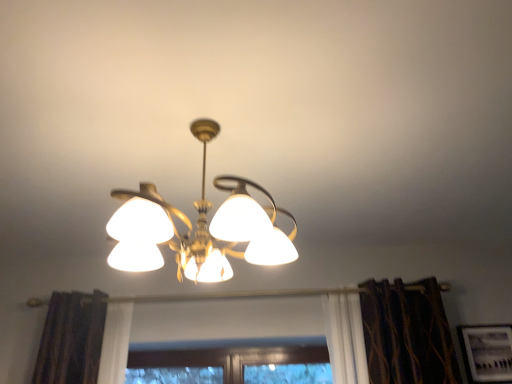
The width and height of the screenshot is (512, 384). Describe the element at coordinates (486, 353) in the screenshot. I see `matte white picture frame at lower right` at that location.

In order to face matte white picture frame at lower right, should I rotate leftwards or rightwards?

A 28.943 degree turn to the right will do.

In order to click on matte white picture frame at lower right in this screenshot , I will do `click(486, 353)`.

You are a GUI agent. You are given a task and a screenshot of the screen. Output one action in this format:
    pyautogui.click(x=<x>, y=<y>)
    Task: Click on the gold metallic chandelier at center
    
    Given the screenshot: What is the action you would take?
    pyautogui.click(x=198, y=227)

Measure the distance between gold metallic chandelier at center and camera.

3.72 feet.

What do you see at coordinates (198, 227) in the screenshot? The height and width of the screenshot is (384, 512). I see `gold metallic chandelier at center` at bounding box center [198, 227].

This screenshot has height=384, width=512. I want to click on matte white picture frame at lower right, so pos(486,353).

Does gold metallic chandelier at center appear on the left side of matte white picture frame at lower right?

Yes, gold metallic chandelier at center is to the left of matte white picture frame at lower right.

Which is behind, gold metallic chandelier at center or matte white picture frame at lower right?

matte white picture frame at lower right is behind.

Between point (247, 237) and point (487, 334), which one is positioned behind?

The point (487, 334) is behind.

From the image's perspective, which one is positioned higher, gold metallic chandelier at center or matte white picture frame at lower right?

gold metallic chandelier at center.

From a real-world perspective, which object rests below the other?

matte white picture frame at lower right, from a real-world perspective.

Looking at this image, looking at their sizes, would you say gold metallic chandelier at center is wider or thinner than matte white picture frame at lower right?

gold metallic chandelier at center is wider than matte white picture frame at lower right.

Considering the sizes of objects gold metallic chandelier at center and matte white picture frame at lower right in the image provided, who is taller, gold metallic chandelier at center or matte white picture frame at lower right?

gold metallic chandelier at center is taller.

Between gold metallic chandelier at center and matte white picture frame at lower right, which one has smaller size?

With smaller size is matte white picture frame at lower right.

Is gold metallic chandelier at center positioned beyond the bounds of matte white picture frame at lower right?

gold metallic chandelier at center is positioned outside matte white picture frame at lower right.

Is gold metallic chandelier at center placed right next to matte white picture frame at lower right?

No, gold metallic chandelier at center is not next to matte white picture frame at lower right.

Is gold metallic chandelier at center aimed at matte white picture frame at lower right?

No, gold metallic chandelier at center is not facing towards matte white picture frame at lower right.

How different are the orientations of gold metallic chandelier at center and matte white picture frame at lower right in degrees?

They differ by 89.7 degrees in their facing directions.

Identify the location of lamp that is above the matte white picture frame at lower right (from the image's perspective). (198, 227).

Visually, is matte white picture frame at lower right positioned to the left or to the right of gold metallic chandelier at center?

From the image, it's evident that matte white picture frame at lower right is to the right of gold metallic chandelier at center.

Is matte white picture frame at lower right closer to camera compared to gold metallic chandelier at center?

No.

Is point (500, 375) positioned before point (216, 278)?

No, (500, 375) is further to viewer.

From the image's perspective, is matte white picture frame at lower right on top of gold metallic chandelier at center?

Actually, matte white picture frame at lower right appears below gold metallic chandelier at center in the image.

From a real-world perspective, is matte white picture frame at lower right on gold metallic chandelier at center?

Actually, matte white picture frame at lower right is physically below gold metallic chandelier at center in the real world.

Considering the sizes of objects matte white picture frame at lower right and gold metallic chandelier at center in the image provided, who is wider, matte white picture frame at lower right or gold metallic chandelier at center?

gold metallic chandelier at center is wider.

Who is taller, matte white picture frame at lower right or gold metallic chandelier at center?

With more height is gold metallic chandelier at center.

Can you confirm if matte white picture frame at lower right is smaller than gold metallic chandelier at center?

Yes.

Based on the photo, is gold metallic chandelier at center a part of matte white picture frame at lower right?

That's incorrect, gold metallic chandelier at center is not inside matte white picture frame at lower right.

Is matte white picture frame at lower right next to gold metallic chandelier at center?

No, matte white picture frame at lower right is not beside gold metallic chandelier at center.

Is matte white picture frame at lower right facing towards gold metallic chandelier at center?

No, matte white picture frame at lower right is not facing towards gold metallic chandelier at center.

Looking at this image, how many degrees apart are the facing directions of matte white picture frame at lower right and gold metallic chandelier at center?

89.7 degrees.

How distant is matte white picture frame at lower right from gold metallic chandelier at center?

matte white picture frame at lower right is 5.20 feet from gold metallic chandelier at center.

Where is `picture frame below the gold metallic chandelier at center (from a real-world perspective)`? The image size is (512, 384). picture frame below the gold metallic chandelier at center (from a real-world perspective) is located at coordinates (486, 353).

The image size is (512, 384). I want to click on picture frame beneath the gold metallic chandelier at center (from a real-world perspective), so click(x=486, y=353).

Find the location of a particular element. picture frame on the right of gold metallic chandelier at center is located at coordinates (486, 353).